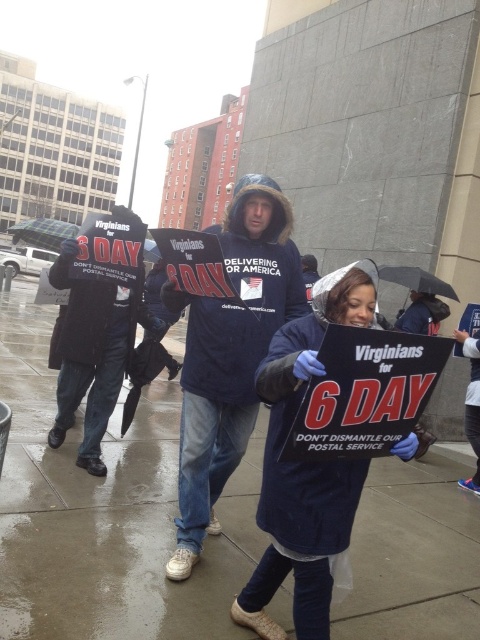
You are a photographer trying to capture a clear shot of the protest signs. You notice two umbrellas in your frame, the green plaid fabric umbrella at upper left and the transparent plastic umbrella at center. Which umbrella might block your view less due to its smaller size?

The transparent plastic umbrella at center has a smaller width than the green plaid fabric umbrella at upper left, so it would block the view less.

You are a photographer trying to capture a clear shot of the navy blue coat at center and the green plaid fabric umbrella at upper left. Given that the umbrella is taller than the coat, where should you position yourself to ensure both are fully visible in the frame?

Since the green plaid fabric umbrella at upper left is taller than the navy blue coat at center, positioning yourself at a lower angle will allow you to capture both the full height of the umbrella and the coat without cropping either object out of the frame.